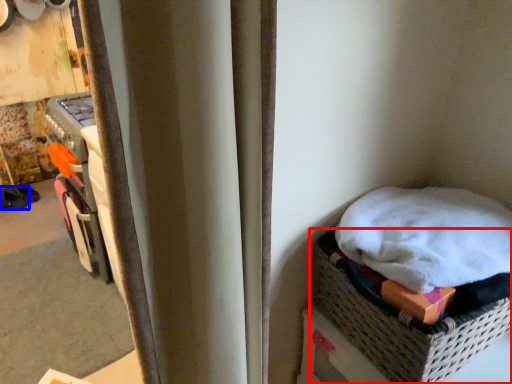
Question: Which object appears closest to the camera in this image, basket (highlighted by a red box) or footwear (highlighted by a blue box)?

Choices:
 (A) basket
 (B) footwear

Answer: (A)